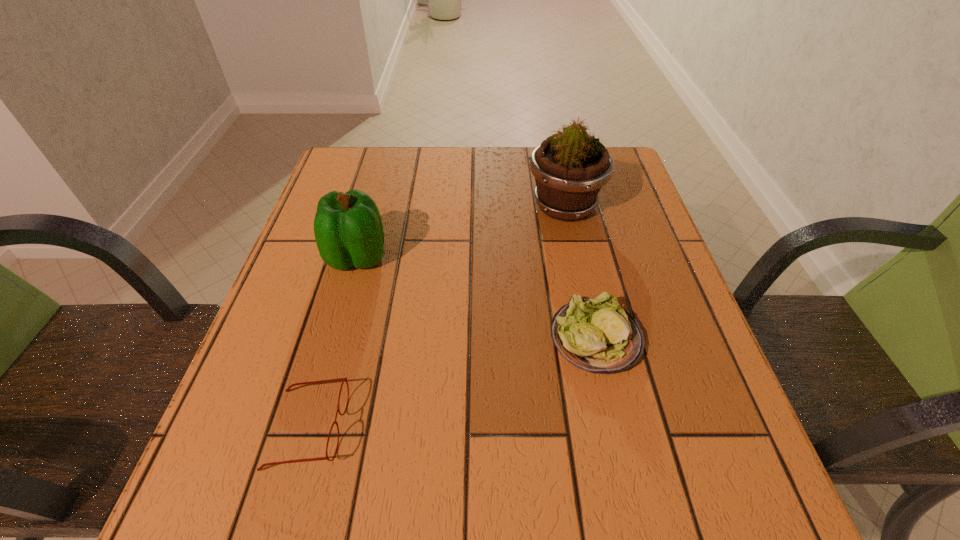
Find the location of a particular element. The height and width of the screenshot is (540, 960). vacant position located 0.160m on the left of the second shortest object is located at coordinates (464, 338).

I want to click on vacant area situated 0.240m on the face of the nearest object, so click(494, 428).

What are the coordinates of `object positioned at the far edge` in the screenshot? It's located at (570, 167).

Locate an element on the screen. This screenshot has width=960, height=540. object located in the near edge section of the desktop is located at coordinates (340, 379).

At what (x,y) coordinates should I click in order to perform the action: click on bell pepper that is at the left edge. Please return your answer as a coordinate pair (x, y). This screenshot has height=540, width=960. Looking at the image, I should click on point(348,229).

Locate an element on the screen. spectacles located at the left edge is located at coordinates (340, 379).

Image resolution: width=960 pixels, height=540 pixels. I want to click on flowerpot positioned at the right edge, so click(x=570, y=167).

Identify the location of lettuce situated at the right edge. Image resolution: width=960 pixels, height=540 pixels. (597, 336).

The height and width of the screenshot is (540, 960). What are the coordinates of `object located at the near left corner` in the screenshot? It's located at (340, 379).

The width and height of the screenshot is (960, 540). In order to click on object that is at the far right corner in this screenshot , I will do `click(570, 167)`.